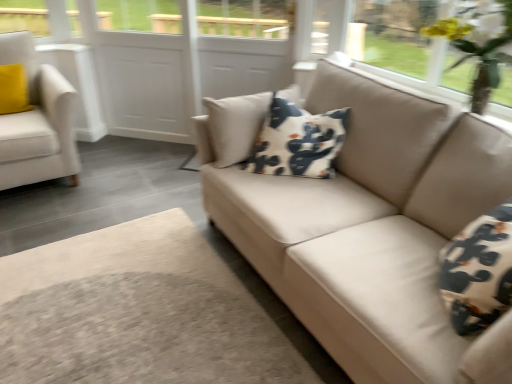
Where is `empty space that is to the right of white fabric armchair at left`? The height and width of the screenshot is (384, 512). empty space that is to the right of white fabric armchair at left is located at coordinates (134, 167).